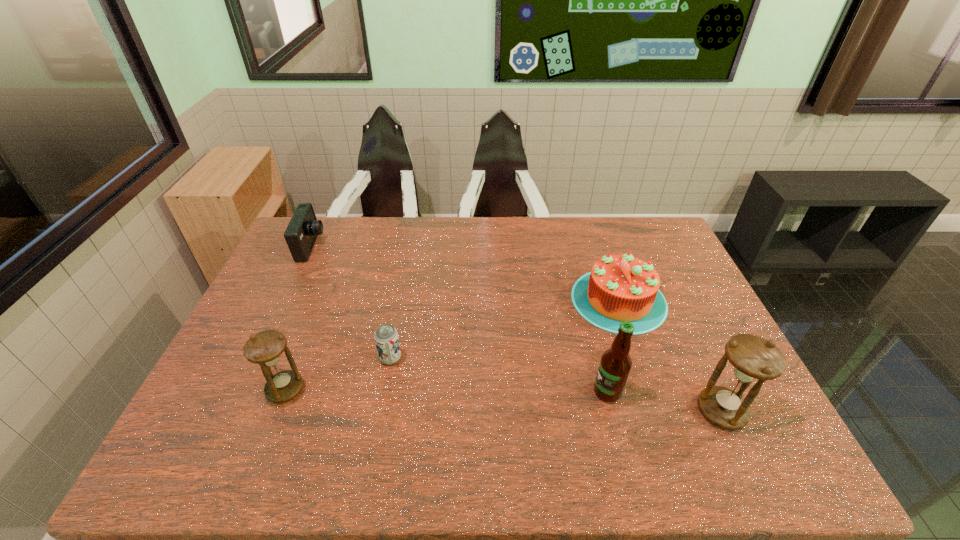
At what (x,y) coordinates should I click in order to perform the action: click on the second object from left to right. Please return your answer as a coordinate pair (x, y). Looking at the image, I should click on (265, 348).

The width and height of the screenshot is (960, 540). Find the location of `the left hourglass`. the left hourglass is located at coordinates (265, 348).

The width and height of the screenshot is (960, 540). I want to click on the taller hourglass, so click(x=753, y=358).

Find the location of a particular element. The height and width of the screenshot is (540, 960). the leftmost object is located at coordinates (301, 233).

Find the location of a particular element. the farthest object is located at coordinates (301, 233).

In order to click on cake in this screenshot , I will do `click(619, 288)`.

Where is `the shortest object`? the shortest object is located at coordinates (386, 338).

Where is `beer can`? Image resolution: width=960 pixels, height=540 pixels. beer can is located at coordinates (386, 338).

This screenshot has height=540, width=960. I want to click on beer bottle, so click(x=615, y=364).

In order to click on free region located on the back of the fifth object from right to left in this screenshot , I will do `click(301, 347)`.